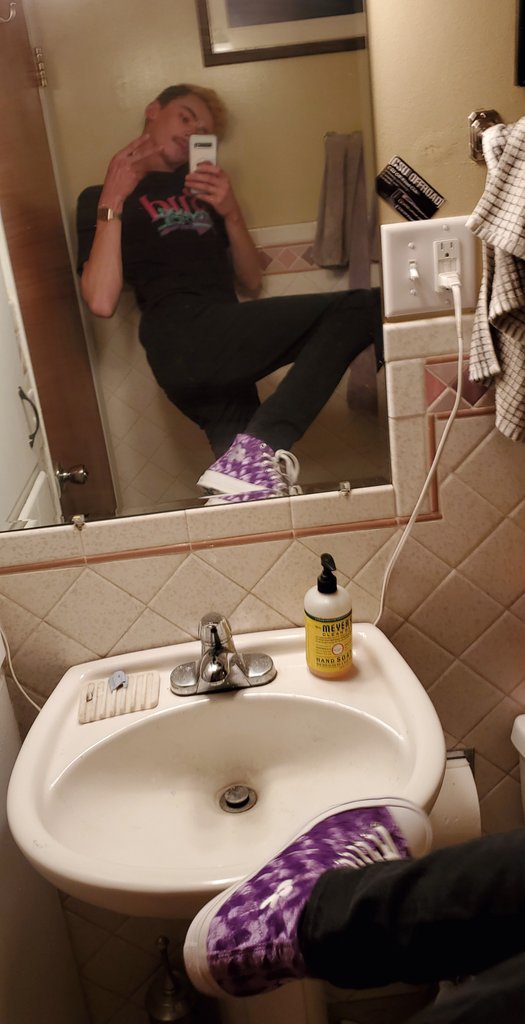
Locate an element on the screen. This screenshot has height=1024, width=525. light switch is located at coordinates (417, 270).